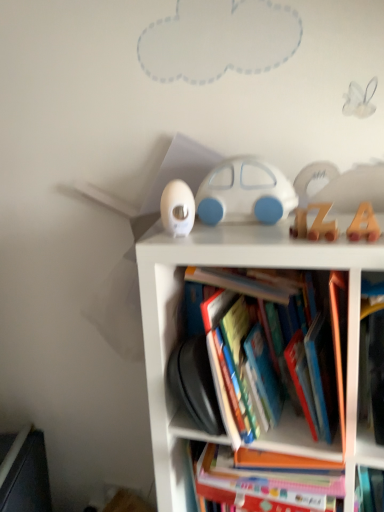
Question: Considering their positions, is white plastic thermometer at upper left, acting as the second toy starting from the back, located in front of or behind white matte car at center, placed as the 4th toy when sorted from front to back?

Choices:
 (A) front
 (B) behind

Answer: (A)

Question: Is white plastic thermometer at upper left, the third toy from the front, bigger or smaller than white matte car at center, placed as the 4th toy when sorted from front to back?

Choices:
 (A) big
 (B) small

Answer: (B)

Question: Which of these objects is positioned farthest from the white plastic thermometer at upper left, acting as the second toy starting from the back?

Choices:
 (A) white plastic bookcase at center
 (B) hardcover book at center
 (C) wooden letter a at upper right, placed as the 4th toy when sorted from back to front
 (D) wooden letter at upper center, arranged as the third toy when viewed from the back
 (E) white matte car at center, positioned as the first toy in back-to-front order

Answer: (B)

Question: Which object is positioned farthest from the white plastic thermometer at upper left, acting as the second toy starting from the back?

Choices:
 (A) hardcover book at center
 (B) white matte car at center, positioned as the first toy in back-to-front order
 (C) wooden letter a at upper right, the first toy positioned from the front
 (D) wooden letter at upper center, arranged as the third toy when viewed from the back
 (E) white plastic bookcase at center

Answer: (A)